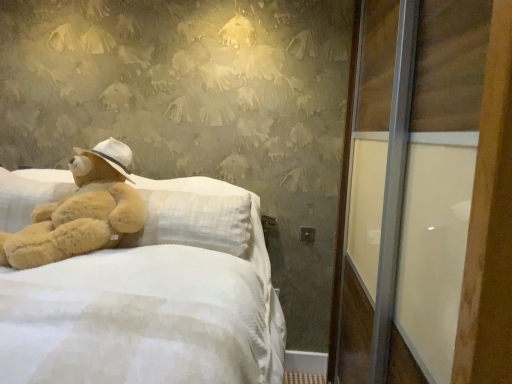
Question: From a real-world perspective, is soft plush bed at left physically above transparent glass screen door at right?

Choices:
 (A) yes
 (B) no

Answer: (B)

Question: Does soft plush bed at left have a smaller size compared to transparent glass screen door at right?

Choices:
 (A) yes
 (B) no

Answer: (B)

Question: Is soft plush bed at left thinner than transparent glass screen door at right?

Choices:
 (A) no
 (B) yes

Answer: (A)

Question: Is soft plush bed at left to the right of transparent glass screen door at right from the viewer's perspective?

Choices:
 (A) no
 (B) yes

Answer: (A)

Question: Would you say soft plush bed at left is a long distance from transparent glass screen door at right?

Choices:
 (A) yes
 (B) no

Answer: (B)

Question: From a real-world perspective, is transparent glass screen door at right physically located above or below soft plush bed at left?

Choices:
 (A) below
 (B) above

Answer: (B)

Question: Is transparent glass screen door at right inside the boundaries of soft plush bed at left, or outside?

Choices:
 (A) outside
 (B) inside

Answer: (A)

Question: Considering the relative positions of transparent glass screen door at right and soft plush bed at left in the image provided, is transparent glass screen door at right to the left or to the right of soft plush bed at left?

Choices:
 (A) right
 (B) left

Answer: (A)

Question: From the image's perspective, relative to soft plush bed at left, is transparent glass screen door at right above or below?

Choices:
 (A) above
 (B) below

Answer: (A)

Question: Is soft plush bed at left inside the boundaries of soft beige plush at left, or outside?

Choices:
 (A) outside
 (B) inside

Answer: (A)

Question: Considering the positions of soft plush bed at left and soft beige plush at left in the image, is soft plush bed at left wider or thinner than soft beige plush at left?

Choices:
 (A) wide
 (B) thin

Answer: (A)

Question: Does point (165, 354) appear closer or farther from the camera than point (59, 200)?

Choices:
 (A) closer
 (B) farther

Answer: (A)

Question: From a real-world perspective, is soft plush bed at left above or below soft beige plush at left?

Choices:
 (A) below
 (B) above

Answer: (A)

Question: From a real-world perspective, is transparent glass screen door at right above or below soft beige plush at left?

Choices:
 (A) below
 (B) above

Answer: (A)

Question: From the image's perspective, is transparent glass screen door at right above or below soft beige plush at left?

Choices:
 (A) above
 (B) below

Answer: (B)